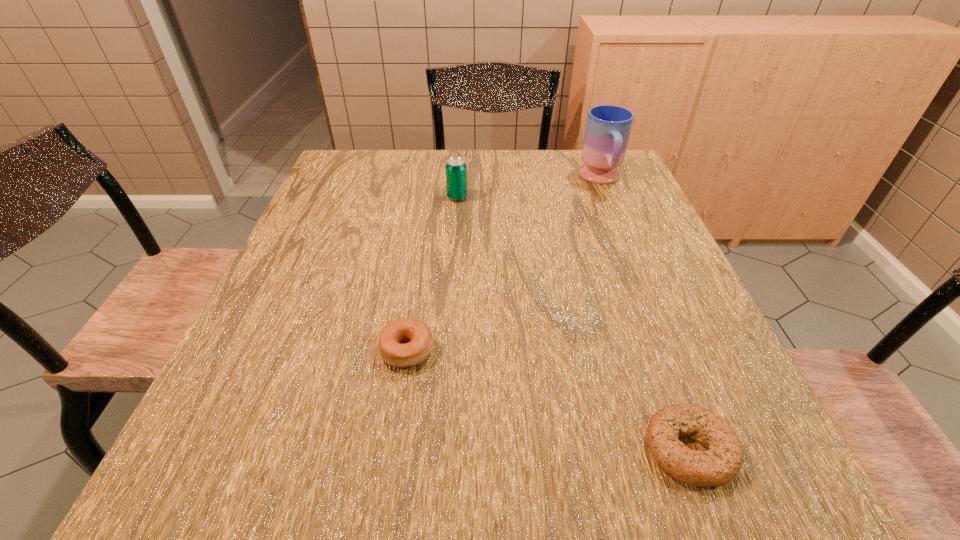
This screenshot has width=960, height=540. Identify the location of the tallest object. (608, 127).

Find the location of `the third shortest object`. the third shortest object is located at coordinates (456, 169).

Locate an element on the screen. The width and height of the screenshot is (960, 540). the farther bagel is located at coordinates (404, 342).

The image size is (960, 540). What are the coordinates of `the second nearest object` in the screenshot? It's located at (404, 342).

The height and width of the screenshot is (540, 960). I want to click on the right bagel, so click(x=719, y=465).

Where is `the nearest object`? This screenshot has height=540, width=960. the nearest object is located at coordinates (719, 465).

Identify the location of free space located on the side of the mug with the handle. This screenshot has width=960, height=540. (624, 237).

Identify the location of vacant position located on the left of the beer can. (x=316, y=197).

Locate an element on the screen. vacant area situated on the front of the left bagel is located at coordinates (394, 438).

The width and height of the screenshot is (960, 540). In order to click on vacant space situated 0.280m on the back of the right bagel in this screenshot , I will do `click(632, 291)`.